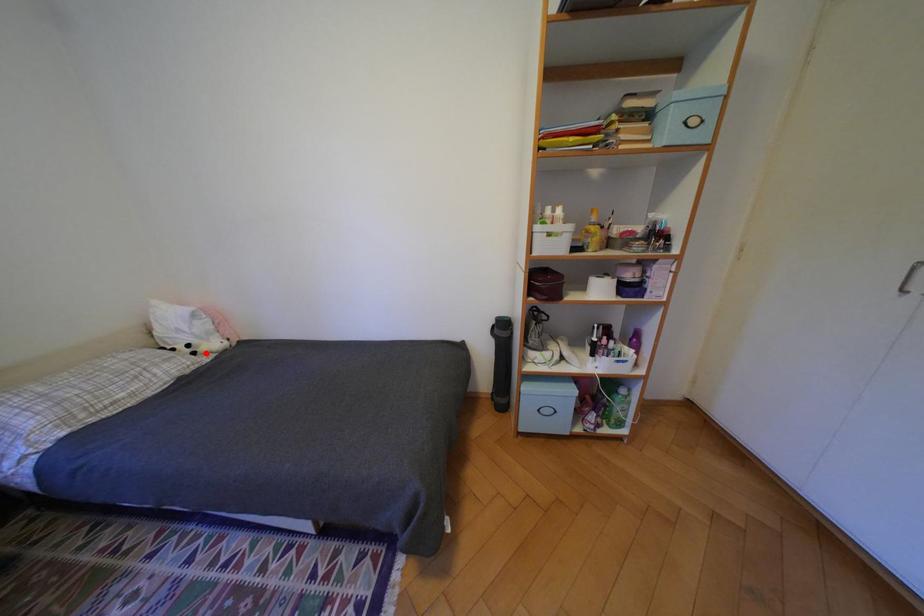
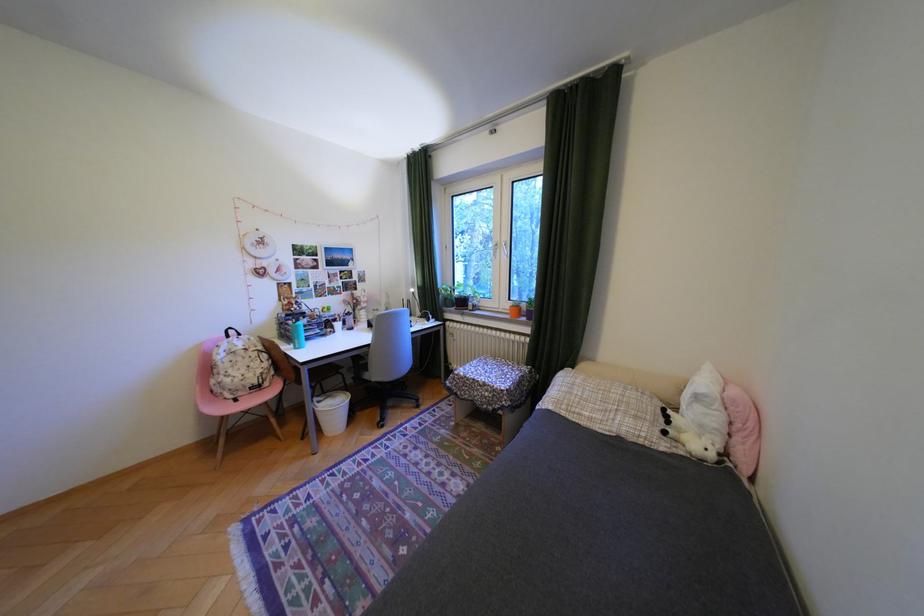
Locate, in the second image, the point that corresponds to the highlighted location in the first image.

(676, 432)